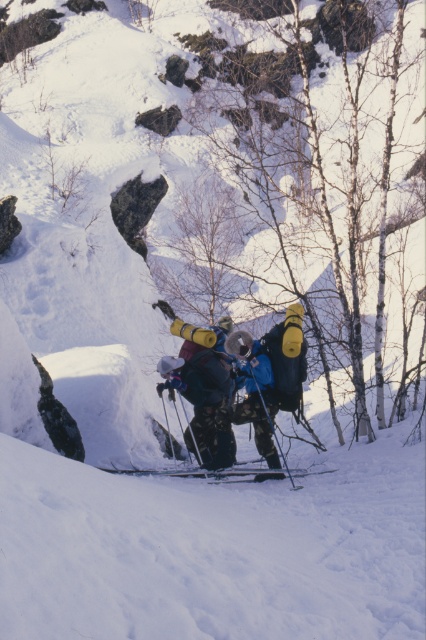
Question: Is dark blue ski suit at center thinner than matte black ski pole at center?

Choices:
 (A) no
 (B) yes

Answer: (A)

Question: Which point is closer to the camera?

Choices:
 (A) dark blue ski suit at center
 (B) matte black ski pole at center
 (C) black matte ski at center

Answer: (C)

Question: Where is dark blue ski suit at center located in relation to matte black ski pole at center in the image?

Choices:
 (A) below
 (B) above

Answer: (A)

Question: Which object appears closest to the camera in this image?

Choices:
 (A) matte black ski pole at center
 (B) dark blue ski suit at center

Answer: (A)

Question: Based on their relative distances, which object is nearer to the dark blue ski suit at center?

Choices:
 (A) black matte ski at center
 (B) matte black ski pole at center

Answer: (B)

Question: Can you confirm if dark blue ski suit at center is thinner than matte black ski pole at center?

Choices:
 (A) yes
 (B) no

Answer: (B)